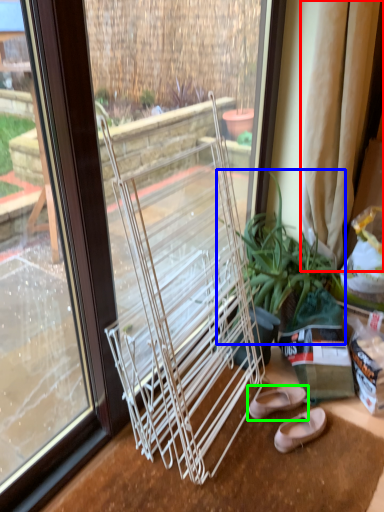
Question: Considering the real-world distances, which object is farthest from curtain (highlighted by a red box)? houseplant (highlighted by a blue box) or footwear (highlighted by a green box)?

Choices:
 (A) houseplant
 (B) footwear

Answer: (B)